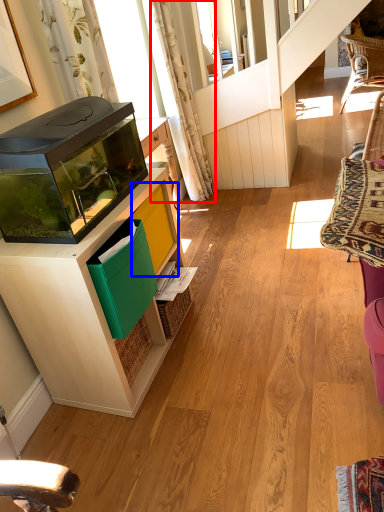
Question: Which object is closer to the camera taking this photo, curtain (highlighted by a red box) or shelf (highlighted by a blue box)?

Choices:
 (A) curtain
 (B) shelf

Answer: (B)